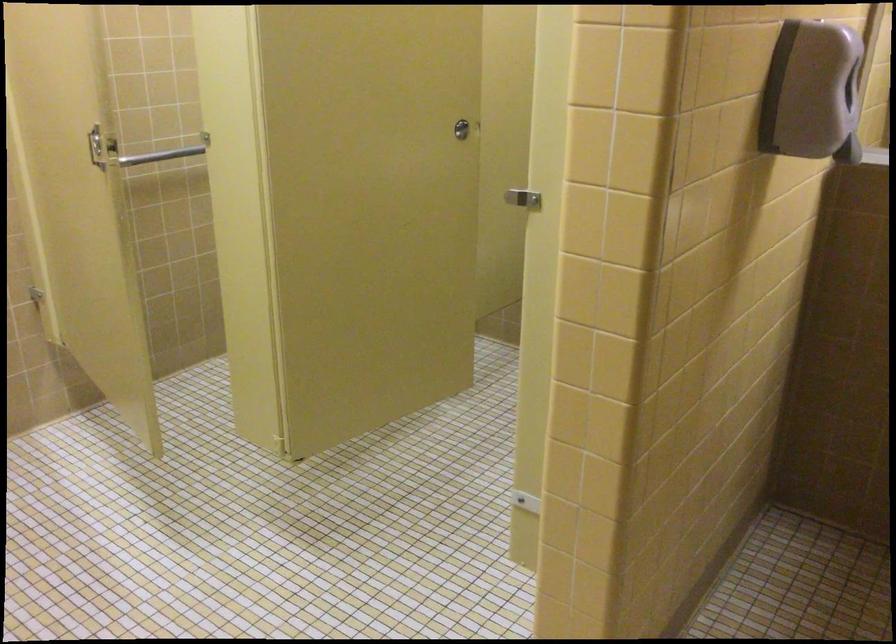
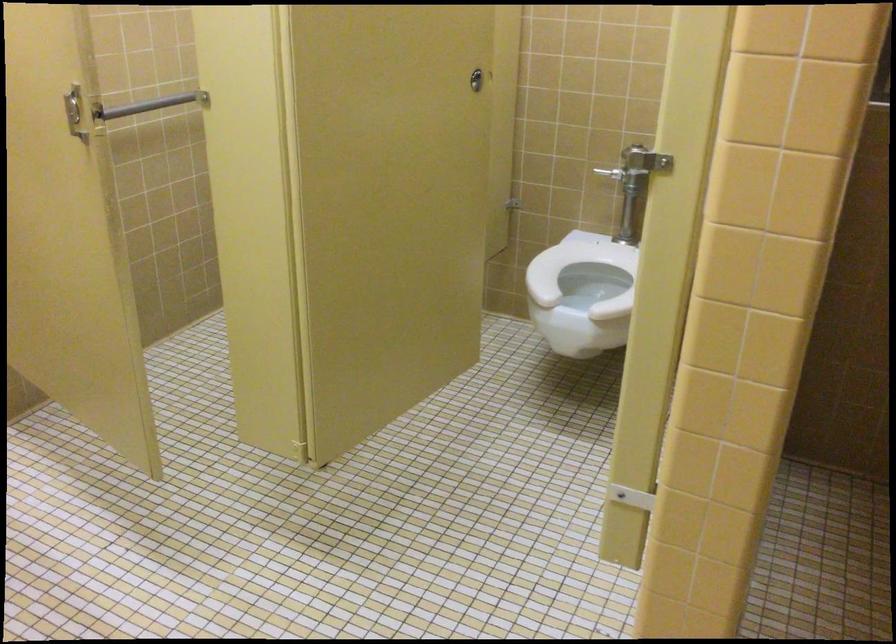
Question: The camera is either moving clockwise (left) or counter-clockwise (right) around the object. The first image is from the beginning of the video and the second image is from the end. Is the camera moving left or right when shooting the video?

Choices:
 (A) Left
 (B) Right

Answer: (A)